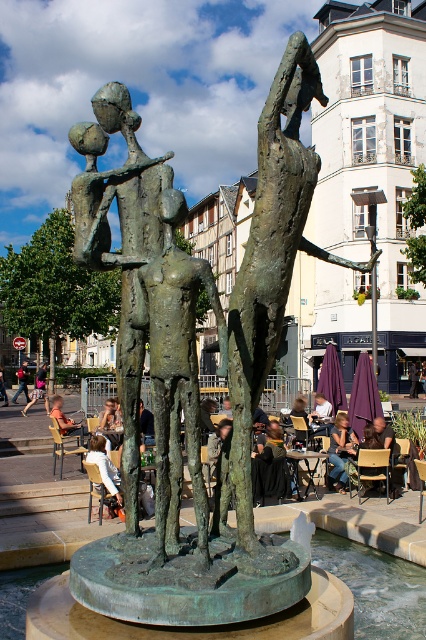
You are a photographer standing in the public square and want to take a photo of the denim jeans at center and the light brown wooden chair at lower left. From your current position, which object is positioned to the right?

The denim jeans at center is positioned to the right of the light brown wooden chair at lower left.